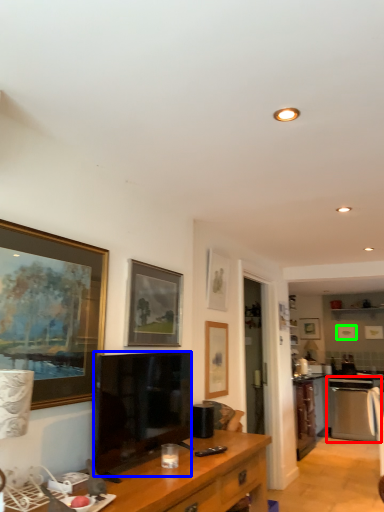
Question: Which object is the closest to the oven (highlighted by a red box)? Choose among these: television (highlighted by a blue box) or picture frame (highlighted by a green box).

Choices:
 (A) television
 (B) picture frame

Answer: (B)